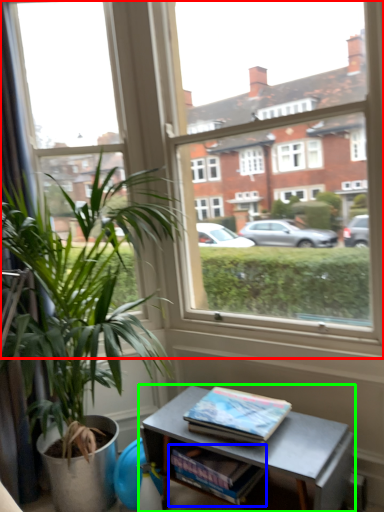
Question: Based on their relative distances, which object is nearer to window (highlighted by a red box)? Choose from magazine (highlighted by a blue box) and table (highlighted by a green box).

Choices:
 (A) magazine
 (B) table

Answer: (B)